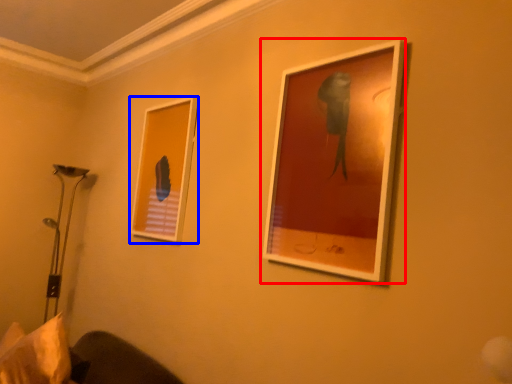
Question: Among these objects, which one is nearest to the camera, picture frame (highlighted by a red box) or picture frame (highlighted by a blue box)?

Choices:
 (A) picture frame
 (B) picture frame

Answer: (A)